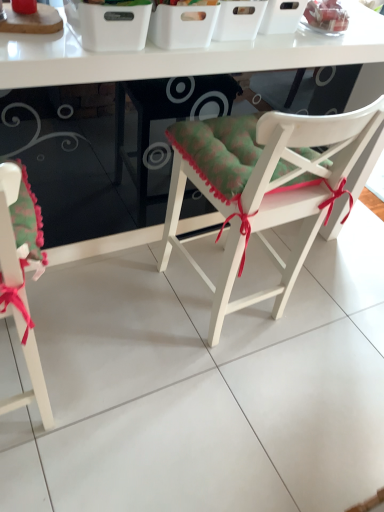
The width and height of the screenshot is (384, 512). Identify the location of blank space to the left of white wood chair at center, arranged as the second chair when viewed from the left. (110, 302).